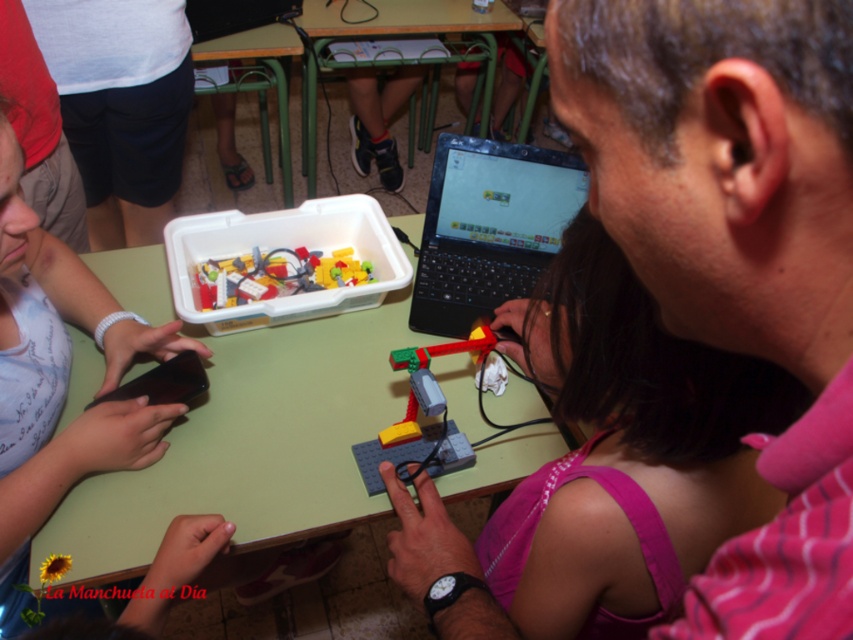
Question: Does pink fabric at center appear over black plastic laptop at center?

Choices:
 (A) no
 (B) yes

Answer: (A)

Question: Considering the real-world distances, which object is closest to the pink fabric at center?

Choices:
 (A) translucent plastic container at center
 (B) black plastic laptop at center
 (C) translucent plastic robot at center

Answer: (C)

Question: Among these objects, which one is nearest to the camera?

Choices:
 (A) translucent plastic robot at center
 (B) black plastic laptop at center
 (C) pink fabric at center
 (D) green plastic table at center

Answer: (C)

Question: Is black plastic laptop at center positioned behind translucent plastic robot at center?

Choices:
 (A) yes
 (B) no

Answer: (A)

Question: Is pink fabric at center positioned behind translucent plastic container at center?

Choices:
 (A) yes
 (B) no

Answer: (B)

Question: Which point is closer to the camera?

Choices:
 (A) (384, 29)
 (B) (260, 294)

Answer: (B)